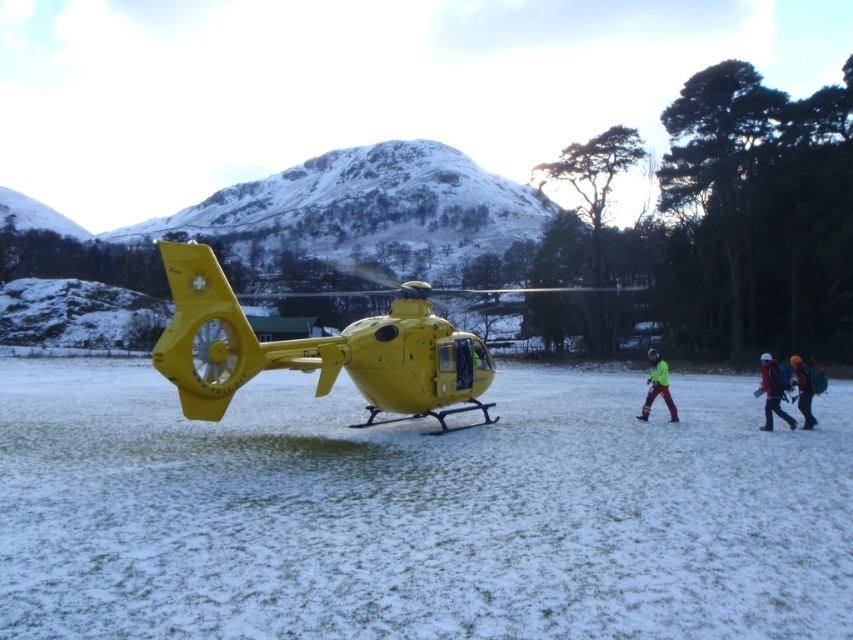
Does point (769, 387) lie behind point (666, 378)?

That is False.

I want to click on red fabric jacket at lower right, so click(772, 392).

The image size is (853, 640). Describe the element at coordinates (772, 392) in the screenshot. I see `red fabric jacket at lower right` at that location.

Find the location of a particular element. This screenshot has width=853, height=640. red fabric jacket at lower right is located at coordinates (772, 392).

Does reflective yellow jacket at center have a smaller size compared to orange knit hat at lower right?

Yes.

This screenshot has height=640, width=853. I want to click on reflective yellow jacket at center, so click(x=657, y=387).

Identify the location of reflective yellow jacket at center. Image resolution: width=853 pixels, height=640 pixels. (657, 387).

Between point (529, 477) and point (650, 360), which one is positioned in front?

Point (529, 477) is more forward.

What do you see at coordinates (416, 512) in the screenshot? I see `white powdery snow at center` at bounding box center [416, 512].

The width and height of the screenshot is (853, 640). Identify the location of white powdery snow at center. (416, 512).